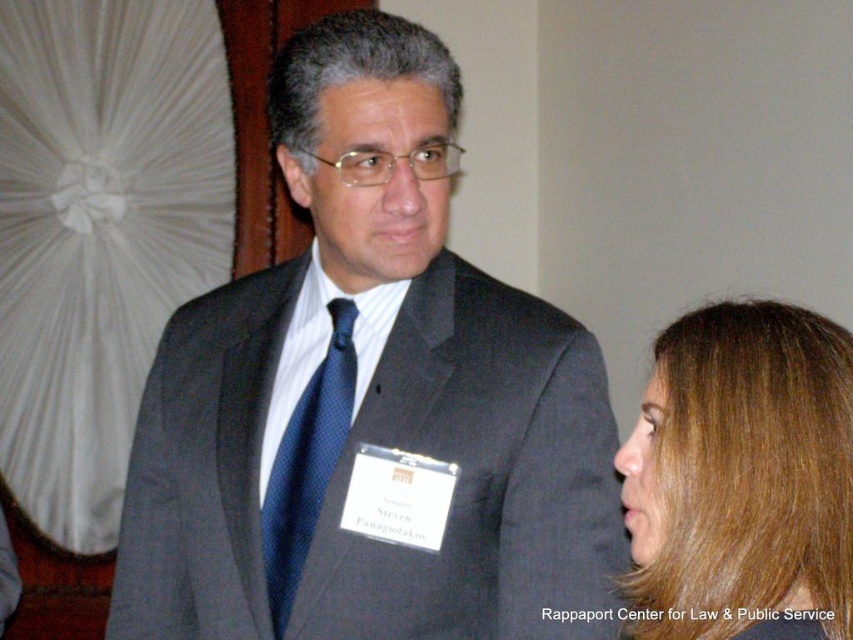
Which is more to the left, brown hair at right or blue dotted tie at center?

Positioned to the left is blue dotted tie at center.

Can you confirm if brown hair at right is positioned above blue dotted tie at center?

No.

Is point (799, 560) closer to camera compared to point (287, 573)?

Yes, point (799, 560) is closer to viewer.

Find the location of a particular element. The width and height of the screenshot is (853, 640). brown hair at right is located at coordinates point(741,477).

Is matte black suit at center taller than blue dotted tie at center?

Yes.

Based on the photo, is matte black suit at center above blue dotted tie at center?

Indeed, matte black suit at center is positioned over blue dotted tie at center.

Is point (592, 424) closer to viewer compared to point (294, 563)?

That is False.

This screenshot has height=640, width=853. I want to click on matte black suit at center, so click(368, 397).

Measure the distance from matte black suit at center to brown hair at right.

18.22 inches

Who is positioned more to the left, matte black suit at center or brown hair at right?

matte black suit at center is more to the left.

Who is more forward, [618,500] or [762,616]?

Point [762,616] is more forward.

Where is `matte black suit at center`? This screenshot has height=640, width=853. matte black suit at center is located at coordinates (368, 397).